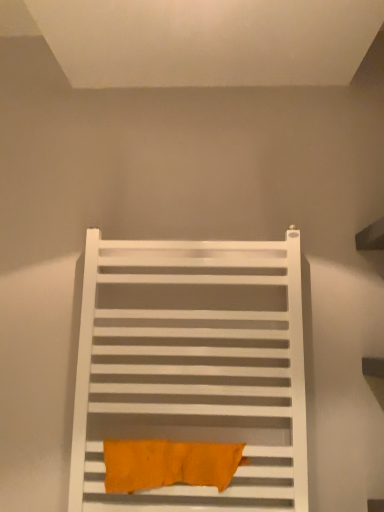
Question: Is point (129, 486) closer or farther from the camera than point (165, 415)?

Choices:
 (A) farther
 (B) closer

Answer: (B)

Question: Do you think orange fabric towel at center is within white matte towel rack at center, or outside of it?

Choices:
 (A) inside
 (B) outside

Answer: (A)

Question: Is orange fabric towel at center bigger or smaller than white matte towel rack at center?

Choices:
 (A) big
 (B) small

Answer: (B)

Question: Is point (281, 348) closer or farther from the camera than point (107, 487)?

Choices:
 (A) closer
 (B) farther

Answer: (B)

Question: From the image's perspective, is white matte towel rack at center located above or below orange fabric towel at center?

Choices:
 (A) below
 (B) above

Answer: (B)

Question: In the image, is white matte towel rack at center positioned in front of or behind orange fabric towel at center?

Choices:
 (A) front
 (B) behind

Answer: (A)

Question: In terms of height, does white matte towel rack at center look taller or shorter compared to orange fabric towel at center?

Choices:
 (A) short
 (B) tall

Answer: (B)